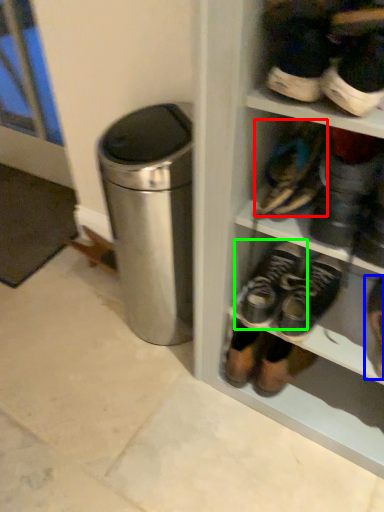
Question: Which object is the closest to the footwear (highlighted by a red box)? Choose among these: footwear (highlighted by a blue box) or footwear (highlighted by a green box).

Choices:
 (A) footwear
 (B) footwear

Answer: (B)